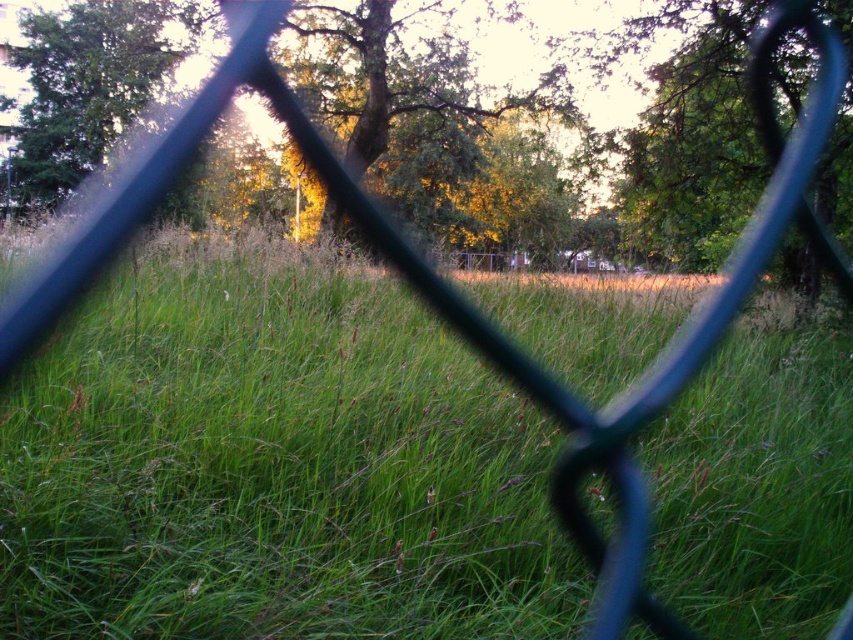
Is green grassy at center taller than green leafy tree at upper left?

Incorrect, green grassy at center's height is not larger of green leafy tree at upper left's.

Between green grassy at center and green leafy tree at upper left, which one has more height?

green leafy tree at upper left

Describe the element at coordinates (273, 465) in the screenshot. I see `green grassy at center` at that location.

The height and width of the screenshot is (640, 853). I want to click on green grassy at center, so click(273, 465).